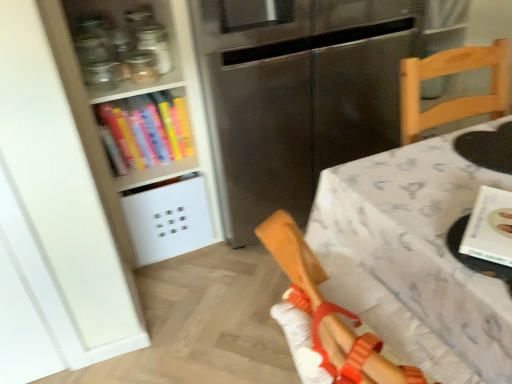
Identify the location of hardcover book at upper left, which appears as the 1th book when viewed from the left. This screenshot has height=384, width=512. (145, 130).

Find the location of a particular element. The image size is (512, 384). transparent glass jar at upper left is located at coordinates (142, 67).

Locate an element on the screen. Image resolution: width=512 pixels, height=384 pixels. white paper book at right, positioned as the 1th book in front-to-back order is located at coordinates (490, 227).

Describe the element at coordinates (297, 95) in the screenshot. The image size is (512, 384). I see `stainless steel fridge at center` at that location.

You are a GUI agent. You are given a task and a screenshot of the screen. Output one action in this format:
    pyautogui.click(x=<x>, y=<y>)
    Task: Click on the hardcover book at upper left, which appears as the 1th book when viewed from the left
    The height and width of the screenshot is (384, 512).
    Given the screenshot: What is the action you would take?
    pyautogui.click(x=145, y=130)

In the scene shown: From a real-world perspective, is hardcover book at upper left, marked as the 2th book in a front-to-back arrangement, positioned over white paper book at right, positioned as the second book in back-to-front order, based on gravity?

No.

Consider the image. Are hardcover book at upper left, which appears as the 1th book when viewed from the left, and white paper book at right, placed as the 2th book when sorted from top to bottom, located far from each other?

Indeed, hardcover book at upper left, which appears as the 1th book when viewed from the left, is not near white paper book at right, placed as the 2th book when sorted from top to bottom.

Considering the relative sizes of hardcover book at upper left, the 1th book when ordered from back to front, and white paper book at right, acting as the 1th book starting from the right, in the image provided, is hardcover book at upper left, the 1th book when ordered from back to front, smaller than white paper book at right, acting as the 1th book starting from the right,?

Actually, hardcover book at upper left, the 1th book when ordered from back to front, might be larger than white paper book at right, acting as the 1th book starting from the right.

How distant is hardcover book at upper left, which is counted as the 1th book, starting from the top, from white paper book at right, acting as the 1th book starting from the right?

They are 4.14 feet apart.

Between stainless steel fridge at center and white textured tablecloth at center, which one has larger width?

With larger width is white textured tablecloth at center.

From a real-world perspective, is stainless steel fridge at center physically below white textured tablecloth at center?

No, from a real-world perspective, stainless steel fridge at center is not under white textured tablecloth at center.

Considering the sizes of objects white textured tablecloth at center and stainless steel fridge at center in the image provided, who is shorter, white textured tablecloth at center or stainless steel fridge at center?

white textured tablecloth at center is shorter.

Can you tell me how much white textured tablecloth at center and stainless steel fridge at center differ in facing direction?

There is a 90-degree angle between the facing directions of white textured tablecloth at center and stainless steel fridge at center.

Are white textured tablecloth at center and stainless steel fridge at center making contact?

No, white textured tablecloth at center is not in contact with stainless steel fridge at center.

Which is in front, point (330, 264) or point (220, 104)?

The point (330, 264) is more forward.

What's the angular difference between wooden chair at right and white paper book at right, which ranks as the 1th book in bottom-to-top order,'s facing directions?

146 degrees separate the facing orientations of wooden chair at right and white paper book at right, which ranks as the 1th book in bottom-to-top order.

Considering the relative sizes of wooden chair at right and white paper book at right, acting as the 1th book starting from the right, in the image provided, is wooden chair at right wider than white paper book at right, acting as the 1th book starting from the right,?

Correct, the width of wooden chair at right exceeds that of white paper book at right, acting as the 1th book starting from the right.

From a real-world perspective, who is located higher, wooden chair at right or white paper book at right, the 2th book in the left-to-right sequence?

white paper book at right, the 2th book in the left-to-right sequence, is physically above.

Considering the positions of objects wooden chair at right and white paper book at right, the 2th book in the left-to-right sequence, in the image provided, who is more to the right, wooden chair at right or white paper book at right, the 2th book in the left-to-right sequence,?

white paper book at right, the 2th book in the left-to-right sequence.

Would you say stainless steel fridge at center is a long distance from transparent glass jar at upper left?

No, stainless steel fridge at center is not far from transparent glass jar at upper left.

From the image's perspective, is stainless steel fridge at center located beneath transparent glass jar at upper left?

Yes, from the image's perspective, stainless steel fridge at center is below transparent glass jar at upper left.

Considering the positions of objects stainless steel fridge at center and transparent glass jar at upper left in the image provided, who is behind, stainless steel fridge at center or transparent glass jar at upper left?

transparent glass jar at upper left.

From a real-world perspective, is stainless steel fridge at center under transparent glass jar at upper left?

Yes.

Is point (357, 365) more distant than point (183, 115)?

No, (357, 365) is closer to viewer.

Could you tell me if wooden chair at right is turned towards hardcover book at upper left, which appears as the 1th book when viewed from the left?

No, wooden chair at right is not turned towards hardcover book at upper left, which appears as the 1th book when viewed from the left.

Measure the distance between wooden chair at right and hardcover book at upper left, which appears as the 1th book when viewed from the left.

The distance of wooden chair at right from hardcover book at upper left, which appears as the 1th book when viewed from the left, is 3.51 feet.

Considering the sizes of white textured tablecloth at center and hardcover book at upper left, marked as the 2th book in a front-to-back arrangement, in the image, is white textured tablecloth at center bigger or smaller than hardcover book at upper left, marked as the 2th book in a front-to-back arrangement,?

white textured tablecloth at center is bigger than hardcover book at upper left, marked as the 2th book in a front-to-back arrangement.

From the picture: From the image's perspective, which one is positioned higher, white textured tablecloth at center or hardcover book at upper left, the 1th book when ordered from back to front?

hardcover book at upper left, the 1th book when ordered from back to front.

Is white textured tablecloth at center outside of hardcover book at upper left, which appears as the 1th book when viewed from the left?

white textured tablecloth at center lies outside hardcover book at upper left, which appears as the 1th book when viewed from the left,'s area.

Considering the positions of objects white textured tablecloth at center and hardcover book at upper left, the 1th book when ordered from back to front, in the image provided, who is more to the right, white textured tablecloth at center or hardcover book at upper left, the 1th book when ordered from back to front,?

Positioned to the right is white textured tablecloth at center.

In the image, there is a hardcover book at upper left, marked as the 2th book in a front-to-back arrangement. What are the coordinates of `book below it (from the image's perspective)` in the screenshot? It's located at (490, 227).

What are the coordinates of `table located on the right of stainless steel fridge at center` in the screenshot? It's located at (419, 242).

Based on their spatial positions, is wooden chair at right or white paper book at right, the 2th book in the left-to-right sequence, further from white textured tablecloth at center?

Among the two, wooden chair at right is located further to white textured tablecloth at center.

Estimate the real-world distances between objects in this image. Which object is closer to wooden chair at right, white paper book at right, positioned as the 1th book in front-to-back order, or stainless steel fridge at center?

white paper book at right, positioned as the 1th book in front-to-back order, lies closer to wooden chair at right than the other object.

From the image, which object appears to be farther from white textured tablecloth at center, transparent glass jar at upper left or hardcover book at upper left, which is counted as the 2th book, starting from the bottom?

transparent glass jar at upper left.

Looking at the image, which one is located further to hardcover book at upper left, marked as the 2th book in a front-to-back arrangement, white paper book at right, positioned as the second book in back-to-front order, or stainless steel fridge at center?

Based on the image, white paper book at right, positioned as the second book in back-to-front order, appears to be further to hardcover book at upper left, marked as the 2th book in a front-to-back arrangement.

Which object lies nearer to the anchor point white textured tablecloth at center, hardcover book at upper left, which is counted as the 1th book, starting from the top, or transparent glass jar at upper left?

hardcover book at upper left, which is counted as the 1th book, starting from the top, is closer to white textured tablecloth at center.

Based on their spatial positions, is white paper book at right, positioned as the 1th book in front-to-back order, or hardcover book at upper left, which appears as the 1th book when viewed from the left, closer to white textured tablecloth at center?

white paper book at right, positioned as the 1th book in front-to-back order, lies closer to white textured tablecloth at center than the other object.

Estimate the real-world distances between objects in this image. Which object is closer to white paper book at right, the 2th book in the left-to-right sequence, white textured tablecloth at center or stainless steel fridge at center?

white textured tablecloth at center.

Which object lies nearer to the anchor point white textured tablecloth at center, hardcover book at upper left, positioned as the second book in right-to-left order, or white paper book at right, positioned as the 1th book in front-to-back order?

The object closer to white textured tablecloth at center is white paper book at right, positioned as the 1th book in front-to-back order.

Where is `fridge between transparent glass jar at upper left and white textured tablecloth at center`? This screenshot has height=384, width=512. fridge between transparent glass jar at upper left and white textured tablecloth at center is located at coordinates (297, 95).

You are a GUI agent. You are given a task and a screenshot of the screen. Output one action in this format:
    pyautogui.click(x=<x>, y=<y>)
    Task: Click on the fridge between hardcover book at upper left, which appears as the 1th book when viewed from the left, and white textured tablecloth at center, in the horizontal direction
    
    Given the screenshot: What is the action you would take?
    pyautogui.click(x=297, y=95)

Locate an element on the screen. This screenshot has height=384, width=512. book located between transparent glass jar at upper left and white textured tablecloth at center in the left-right direction is located at coordinates (490, 227).

I want to click on book situated between wooden chair at right and white textured tablecloth at center from left to right, so click(x=490, y=227).